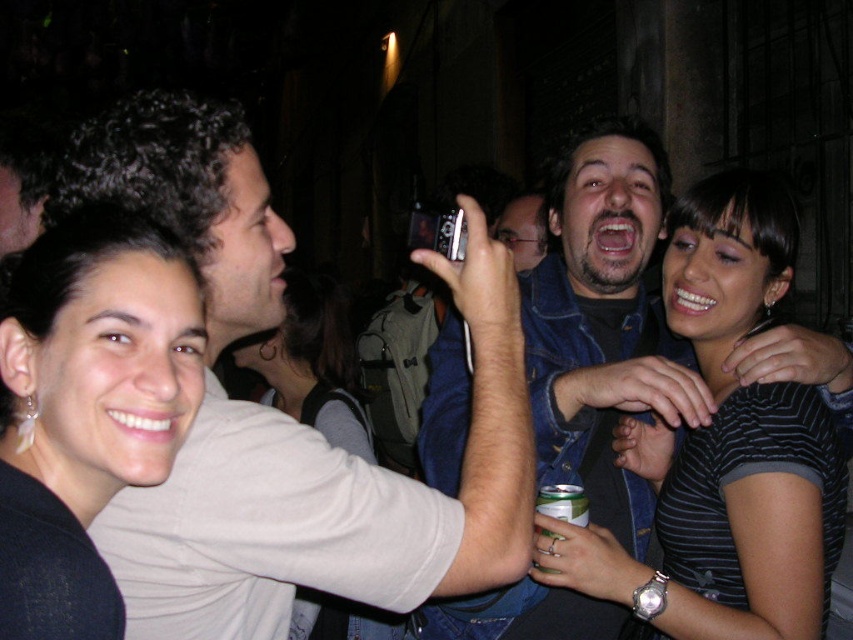
Who is higher up, striped fabric shirt at center or black matte hair at upper left?

black matte hair at upper left is higher up.

Who is more forward, (816, 529) or (18, 360)?

Point (18, 360) is more forward.

Find the location of a particular element. This screenshot has width=853, height=640. striped fabric shirt at center is located at coordinates (728, 449).

Describe the element at coordinates (328, 500) in the screenshot. The width and height of the screenshot is (853, 640). I see `matte white shirt at upper left` at that location.

Who is more forward, (305,547) or (142,232)?

Positioned in front is point (142,232).

Who is more forward, (244, 324) or (73, 369)?

Positioned in front is point (73, 369).

This screenshot has height=640, width=853. What are the coordinates of `matte white shirt at upper left` in the screenshot? It's located at (328, 500).

Does matte white shirt at upper left lie behind striped fabric shirt at center?

No, it is in front of striped fabric shirt at center.

Does point (219, 461) lie behind point (721, 444)?

No, it is in front of (721, 444).

Measure the distance between matte white shirt at upper left and camera.

1.04 meters

Find the location of a particular element. The width and height of the screenshot is (853, 640). matte white shirt at upper left is located at coordinates (328, 500).